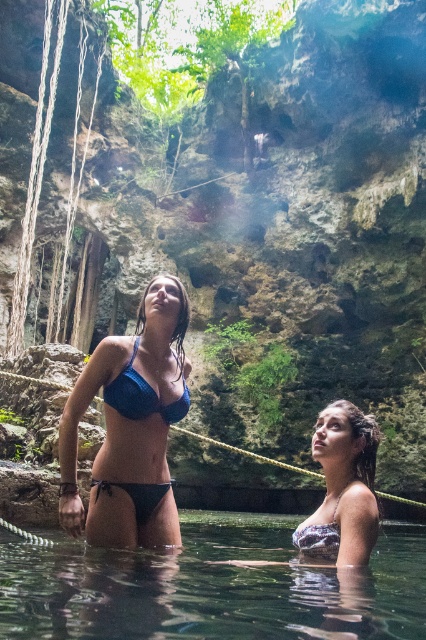
Does blue sequined bikini top at center appear on the right side of white lace bikini at lower center?

No, blue sequined bikini top at center is not to the right of white lace bikini at lower center.

Can you confirm if blue sequined bikini top at center is positioned to the left of white lace bikini at lower center?

Indeed, blue sequined bikini top at center is positioned on the left side of white lace bikini at lower center.

Who is more distant from viewer, (126, 368) or (325, 497)?

The point (325, 497) is behind.

This screenshot has width=426, height=640. What are the coordinates of `blue sequined bikini top at center` in the screenshot? It's located at (143, 394).

Is point (321, 420) positioned behind point (310, 525)?

Yes, point (321, 420) is farther from viewer.

Is point (368, 484) behind point (333, 513)?

Yes, it is.

You are a GUI agent. You are given a task and a screenshot of the screen. Output one action in this format:
    pyautogui.click(x=<x>, y=<y>)
    Task: Click on the patterned fabric bikini top at lower center
    
    Given the screenshot: What is the action you would take?
    pyautogui.click(x=342, y=486)

Does patterned fabric bikini top at lower center appear on the right side of blue sequined bikini top at center?

Yes, patterned fabric bikini top at lower center is to the right of blue sequined bikini top at center.

Is point (359, 432) positioned in front of point (161, 406)?

Yes, it is.

Measure the distance between patterned fabric bikini top at lower center and camera.

patterned fabric bikini top at lower center is 2.55 meters away from camera.

The height and width of the screenshot is (640, 426). Identify the location of patterned fabric bikini top at lower center. (342, 486).